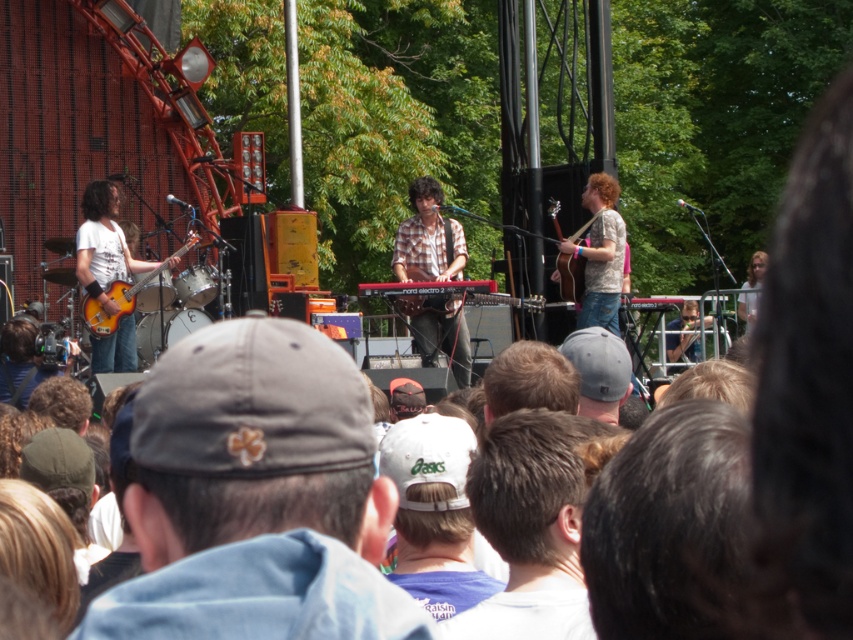
You are at the concert and want to take a photo of the plaid shirt at center. What are the coordinates where you should aim your camera?

The plaid shirt at center is located at coordinates point (428, 237).

In the scene shown: You are a photographer at the concert and want to capture both the matte yellow guitar at left and the matte yellow electric guitar at left in a single frame. Which guitar should you position closer to the camera to ensure both fit in the shot?

Since the matte yellow guitar at left is shorter than the matte yellow electric guitar at left, you should position the shorter matte yellow guitar at left closer to the camera to ensure both fit in the shot.

You are standing at the center of the stage and want to place a microphone stand at the point marked as point (254,496). Is this point located on the denim cap at center?

Yes, the point (254,496) is on the denim cap at center, so placing the microphone stand there would be appropriate.